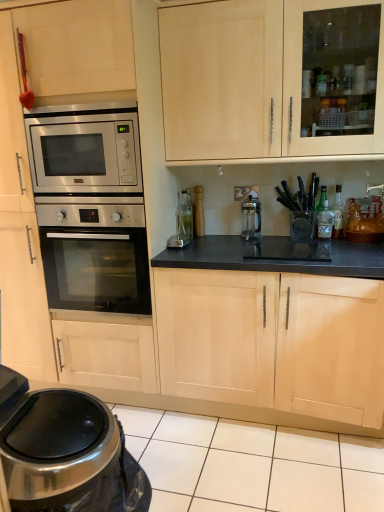
Describe the element at coordinates (66, 453) in the screenshot. I see `metallic trash can at lower left` at that location.

This screenshot has width=384, height=512. In order to click on clear glass bottle at center right, the third bottle when ordered from left to right in this screenshot , I will do `click(338, 214)`.

Identify the location of clear glass bottle at center-right, the second bottle positioned from the left. Image resolution: width=384 pixels, height=512 pixels. (320, 206).

The image size is (384, 512). What do you see at coordinates (84, 149) in the screenshot?
I see `stainless steel microwave oven at left` at bounding box center [84, 149].

Find the location of a particular element. The width and height of the screenshot is (384, 512). stainless steel microwave oven at left is located at coordinates (84, 149).

The height and width of the screenshot is (512, 384). What are the coordinates of `metallic trash can at lower left` in the screenshot? It's located at (66, 453).

The image size is (384, 512). Identify the location of cabinetry beneath the clear glass bottle at center-right, placed as the 1th bottle when sorted from left to right (from a real-world perspective). (274, 341).

Considering the relative sizes of clear glass bottle at center-right, the third bottle when ordered from right to left, and light wood cabinet at center in the image provided, is clear glass bottle at center-right, the third bottle when ordered from right to left, taller than light wood cabinet at center?

No.

What's the angular difference between clear glass bottle at center-right, the third bottle when ordered from right to left, and light wood cabinet at center's facing directions?

clear glass bottle at center-right, the third bottle when ordered from right to left, and light wood cabinet at center are facing 1.55 degrees away from each other.

From the image's perspective, count 2nd bottles downward from the stainless steel microwave oven at left and point to it. Please provide its 2D coordinates.

[(338, 214)]

Does stainless steel microwave oven at left touch clear glass bottle at center right, the third bottle when ordered from left to right?

No, stainless steel microwave oven at left is not making contact with clear glass bottle at center right, the third bottle when ordered from left to right.

Could clear glass bottle at center right, arranged as the 1th bottle when viewed from the right, be considered to be inside stainless steel microwave oven at left?

Actually, clear glass bottle at center right, arranged as the 1th bottle when viewed from the right, is outside stainless steel microwave oven at left.

In the image, is metallic trash can at lower left positioned in front of or behind clear glass bottle at center-right, the third bottle when ordered from right to left?

metallic trash can at lower left is positioned closer to the viewer than clear glass bottle at center-right, the third bottle when ordered from right to left.

From a real-world perspective, who is located lower, metallic trash can at lower left or clear glass bottle at center-right, placed as the 1th bottle when sorted from left to right?

From a 3D spatial view, metallic trash can at lower left is below.

Which object is wider, metallic trash can at lower left or clear glass bottle at center-right, placed as the 1th bottle when sorted from left to right?

metallic trash can at lower left is wider.

Can you confirm if metallic trash can at lower left is bigger than clear glass bottle at center-right, the third bottle when ordered from right to left?

Indeed, metallic trash can at lower left has a larger size compared to clear glass bottle at center-right, the third bottle when ordered from right to left.

Does brushed metal faucet at upper right contain clear glass bottle at center-right, the third bottle when ordered from right to left?

No.

Between brushed metal faucet at upper right and clear glass bottle at center-right, placed as the 1th bottle when sorted from left to right, which one appears on the right side from the viewer's perspective?

From the viewer's perspective, brushed metal faucet at upper right appears more on the right side.

Is brushed metal faucet at upper right in front of or behind clear glass bottle at center-right, placed as the 1th bottle when sorted from left to right, in the image?

Clearly, brushed metal faucet at upper right is behind clear glass bottle at center-right, placed as the 1th bottle when sorted from left to right.

Does point (379, 196) come in front of point (324, 219)?

Yes, point (379, 196) is closer to viewer.

Is metallic trash can at lower left facing towards clear glass bottle at center right, arranged as the 1th bottle when viewed from the right?

No, metallic trash can at lower left is not turned towards clear glass bottle at center right, arranged as the 1th bottle when viewed from the right.

Where is `home appliance that is in front of the clear glass bottle at center right, arranged as the 1th bottle when viewed from the right`? The width and height of the screenshot is (384, 512). home appliance that is in front of the clear glass bottle at center right, arranged as the 1th bottle when viewed from the right is located at coordinates (66, 453).

Is metallic trash can at lower left directly adjacent to clear glass bottle at center right, the third bottle when ordered from left to right?

metallic trash can at lower left and clear glass bottle at center right, the third bottle when ordered from left to right, are not in contact.

Is clear glass bottle at center right, the third bottle when ordered from left to right, surrounded by metallic trash can at lower left?

No, clear glass bottle at center right, the third bottle when ordered from left to right, is not inside metallic trash can at lower left.

Consider the image. Which object is further away from the camera taking this photo, light wood cabinet at center or satin silver coffee maker at center?

satin silver coffee maker at center is more distant.

Is light wood cabinet at center to the left of satin silver coffee maker at center from the viewer's perspective?

No, light wood cabinet at center is not to the left of satin silver coffee maker at center.

I want to click on appliance positioned vertically above the light wood cabinet at center (from a real-world perspective), so click(251, 217).

Is point (362, 417) closer or farther from the camera than point (253, 217)?

Clearly, point (362, 417) is closer to the camera than point (253, 217).

Is clear glass bottle at center-right, the second bottle positioned from the left, not close to clear glass bottle at center right, the third bottle when ordered from left to right?

Actually, clear glass bottle at center-right, the second bottle positioned from the left, and clear glass bottle at center right, the third bottle when ordered from left to right, are a little close together.

Looking at this image, from the image's perspective, is clear glass bottle at center-right, acting as the second bottle starting from the right, above clear glass bottle at center right, the third bottle when ordered from left to right?

Indeed, from the image's perspective, clear glass bottle at center-right, acting as the second bottle starting from the right, is shown above clear glass bottle at center right, the third bottle when ordered from left to right.

From a real-world perspective, is clear glass bottle at center-right, the second bottle positioned from the left, positioned above or below clear glass bottle at center right, the third bottle when ordered from left to right?

clear glass bottle at center-right, the second bottle positioned from the left, is above clear glass bottle at center right, the third bottle when ordered from left to right.

From a real-world perspective, which bottle is the 1st one above the light wood cabinet at center? Please provide its 2D coordinates.

[(325, 222)]

Locate an element on the screen. This screenshot has height=512, width=384. the 2nd bottle behind when counting from the stainless steel microwave oven at left is located at coordinates (338, 214).

Estimate the real-world distances between objects in this image. Which object is closer to stainless steel oven at left, satin silver coffee maker at center or stainless steel microwave oven at left?

stainless steel microwave oven at left is positioned closer to the anchor stainless steel oven at left.

Which object lies nearer to the anchor point clear glass bottle at center-right, placed as the 1th bottle when sorted from left to right, metallic trash can at lower left or light wood cabinet at center?

light wood cabinet at center is positioned closer to the anchor clear glass bottle at center-right, placed as the 1th bottle when sorted from left to right.

From the image, which object appears to be nearer to clear glass bottle at center-right, placed as the 1th bottle when sorted from left to right, stainless steel oven at left or brushed metal faucet at upper right?

The object closer to clear glass bottle at center-right, placed as the 1th bottle when sorted from left to right, is brushed metal faucet at upper right.

Considering their positions, is stainless steel microwave oven at left positioned further to brushed metal faucet at upper right than clear glass bottle at center right, arranged as the 1th bottle when viewed from the right?

stainless steel microwave oven at left is further to brushed metal faucet at upper right.

Based on the photo, based on their spatial positions, is light wood cabinet at center or clear glass bottle at center-right, the third bottle when ordered from right to left, further from metallic trash can at lower left?

Among the two, clear glass bottle at center-right, the third bottle when ordered from right to left, is located further to metallic trash can at lower left.

Estimate the real-world distances between objects in this image. Which object is closer to clear glass bottle at center-right, the second bottle positioned from the left, clear glass bottle at center right, arranged as the 1th bottle when viewed from the right, or satin silver coffee maker at center?

clear glass bottle at center right, arranged as the 1th bottle when viewed from the right, is positioned closer to the anchor clear glass bottle at center-right, the second bottle positioned from the left.

Considering their positions, is metallic trash can at lower left positioned closer to light wood cabinet at center than brushed metal faucet at upper right?

The object closer to light wood cabinet at center is brushed metal faucet at upper right.

Estimate the real-world distances between objects in this image. Which object is further from metallic trash can at lower left, brushed metal faucet at upper right or clear glass bottle at center right, arranged as the 1th bottle when viewed from the right?

brushed metal faucet at upper right is further to metallic trash can at lower left.

Where is `bottle that lies between satin silver coffee maker at center and light wood cabinet at center from top to bottom`? bottle that lies between satin silver coffee maker at center and light wood cabinet at center from top to bottom is located at coordinates (325, 222).

Identify the location of appliance between stainless steel oven at left and clear glass bottle at center right, the third bottle when ordered from left to right. The width and height of the screenshot is (384, 512). (251, 217).

Locate an element on the screen. This screenshot has height=512, width=384. oven between stainless steel microwave oven at left and metallic trash can at lower left in the up-down direction is located at coordinates (95, 257).

In order to click on oven between stainless steel microwave oven at left and clear glass bottle at center-right, acting as the second bottle starting from the right, in the horizontal direction in this screenshot , I will do `click(95, 257)`.